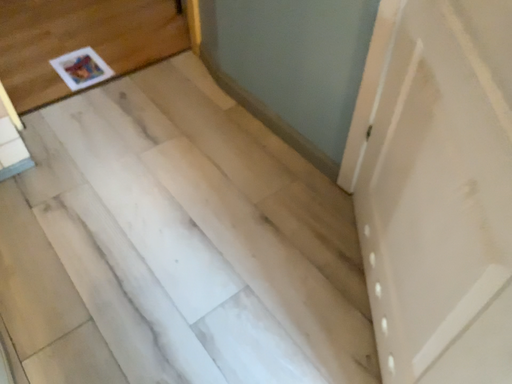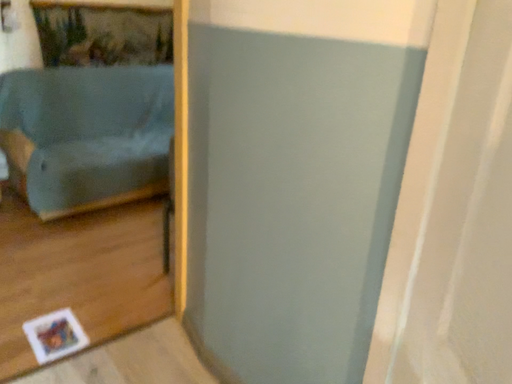
Question: Which way did the camera rotate in the video?

Choices:
 (A) rotated downward
 (B) rotated upward

Answer: (B)